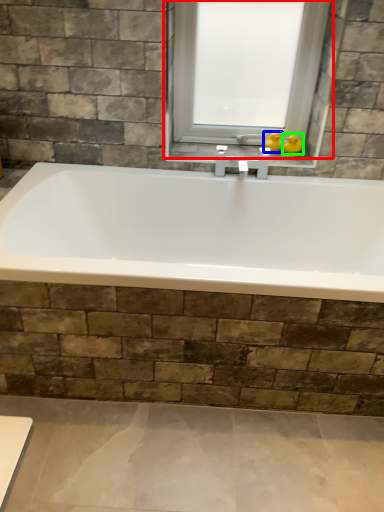
Question: Which is nearer to the window (highlighted by a red box)? duck (highlighted by a blue box) or duck (highlighted by a green box).

Choices:
 (A) duck
 (B) duck

Answer: (A)